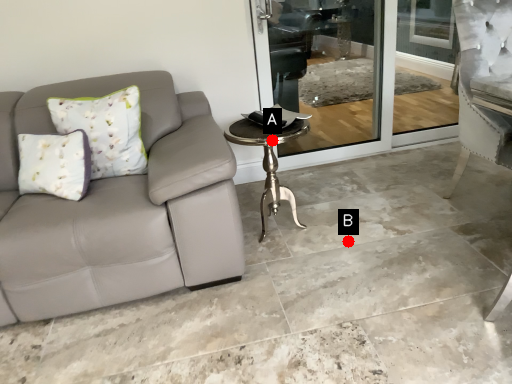
Question: Two points are circled on the image, labeled by A and B beside each circle. Which point appears farthest from the camera in this image?

Choices:
 (A) A is further
 (B) B is further

Answer: (B)